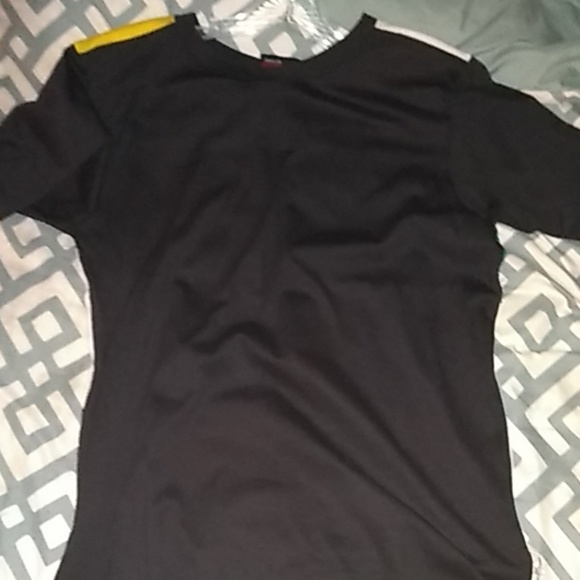
This screenshot has width=580, height=580. I want to click on comforter, so pos(34,338).